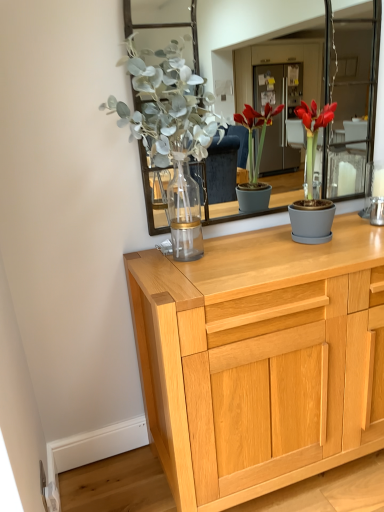
Identify the location of unoccupied region to the right of matte gray pot at center. (354, 237).